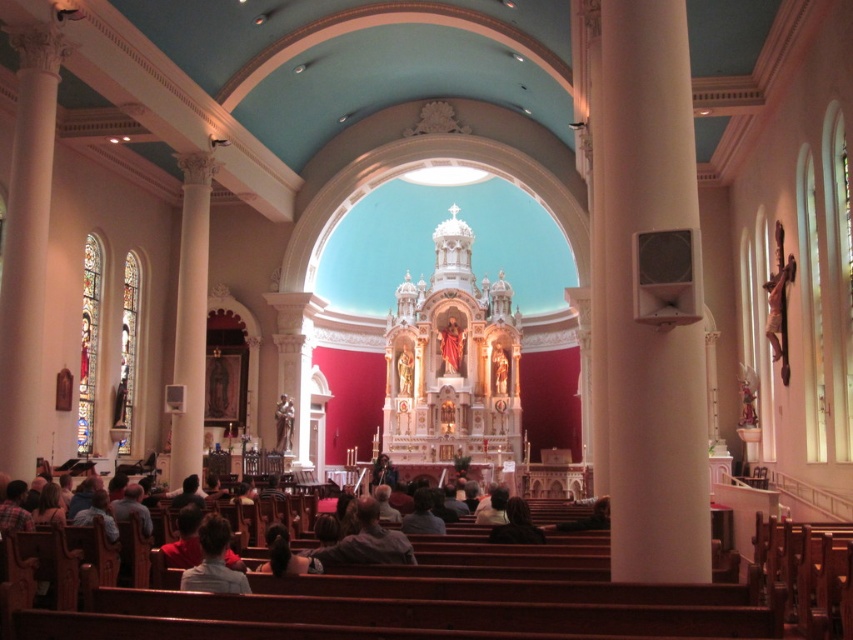
Is the position of white glossy speaker at right more distant than that of dark gray sweater at lower center?

Yes, white glossy speaker at right is further from the viewer.

Is point (631, 28) positioned after point (218, 580)?

Yes, it is behind point (218, 580).

Identify the location of white glossy speaker at right. Image resolution: width=853 pixels, height=640 pixels. (637, 296).

Is dark hair at center to the left of matte red statue at center from the viewer's perspective?

Incorrect, dark hair at center is not on the left side of matte red statue at center.

What do you see at coordinates (515, 525) in the screenshot? Image resolution: width=853 pixels, height=640 pixels. I see `dark hair at center` at bounding box center [515, 525].

This screenshot has width=853, height=640. Find the location of `dark hair at center`. dark hair at center is located at coordinates (515, 525).

Measure the distance between dark hair at center and matte bronze statue at center.

They are 44.26 meters apart.

Is dark hair at center below matte bronze statue at center?

Indeed, dark hair at center is positioned under matte bronze statue at center.

Locate an element on the screen. This screenshot has height=640, width=853. dark hair at center is located at coordinates (515, 525).

This screenshot has width=853, height=640. Find the location of `dark hair at center`. dark hair at center is located at coordinates (515, 525).